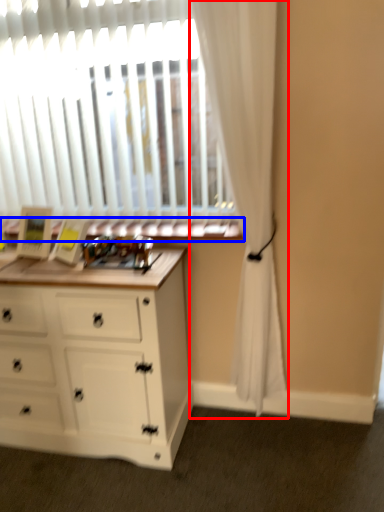
Question: Which object appears farthest to the camera in this image, curtain (highlighted by a red box) or window sill (highlighted by a blue box)?

Choices:
 (A) curtain
 (B) window sill

Answer: (B)